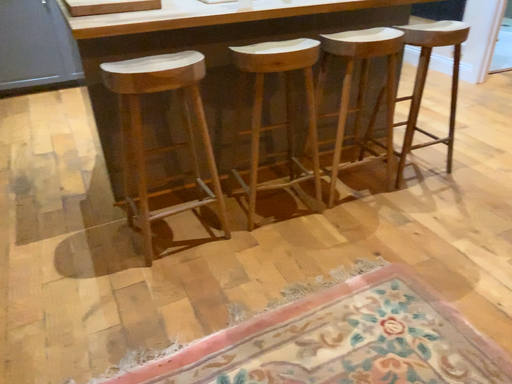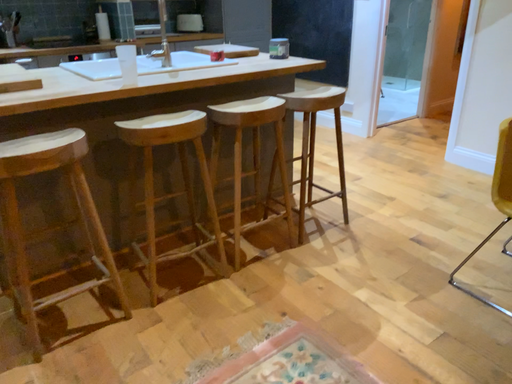
Question: How did the camera likely rotate when shooting the video?

Choices:
 (A) rotated downward
 (B) rotated upward

Answer: (B)